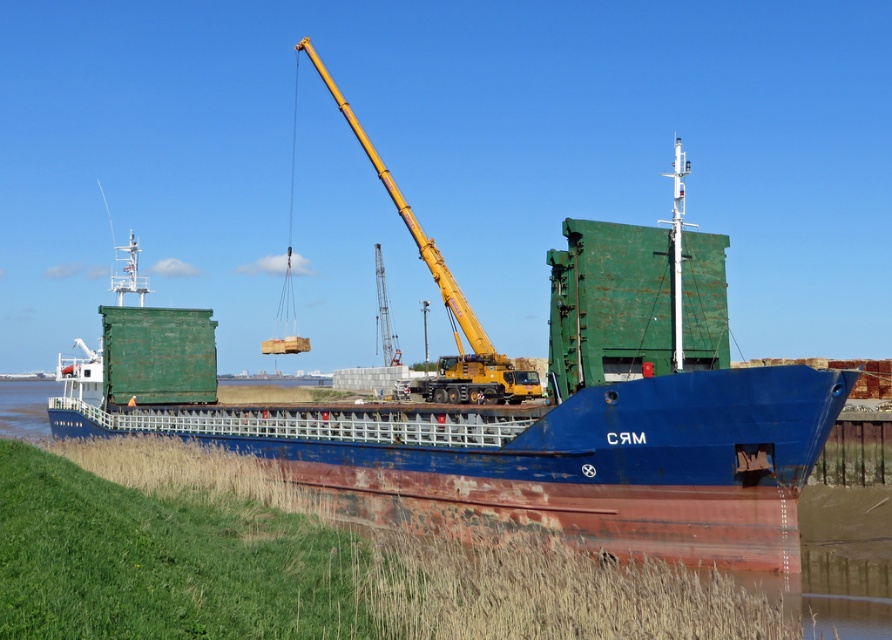
You are a dock worker trying to load a container onto the rusty metal barge at center. The yellow metallic crane at center has a maximum reach of 20 meters. Can the crane safely reach the edge of the barge without extending beyond its operational limits?

The rusty metal barge at center is wider than the yellow metallic crane at center. Since the barge is wider, the crane may not be able to fully reach the edges of the barge without exceeding its 20 meters reach limit. Check the exact dimensions to confirm.

You are a dock worker standing at the edge of the riverbank. You need to place a new container onto the rusty metal barge at center. Given the barge is at coordinates point 0.653, 0.600, can you determine its position relative to the crane?

The rusty metal barge at center is located at point (534, 417), so the crane must be positioned in a way that allows it to reach this coordinate to place the container. Since the crane is actively lifting a container onto the barge, it is likely positioned near or aligned with these coordinates to ensure proper placement.

You are a cargo inspector standing at the riverbank. You need to locate the rusty metal barge at center. Where can you find it in terms of coordinates?

The rusty metal barge at center is located at coordinates point (534, 417).